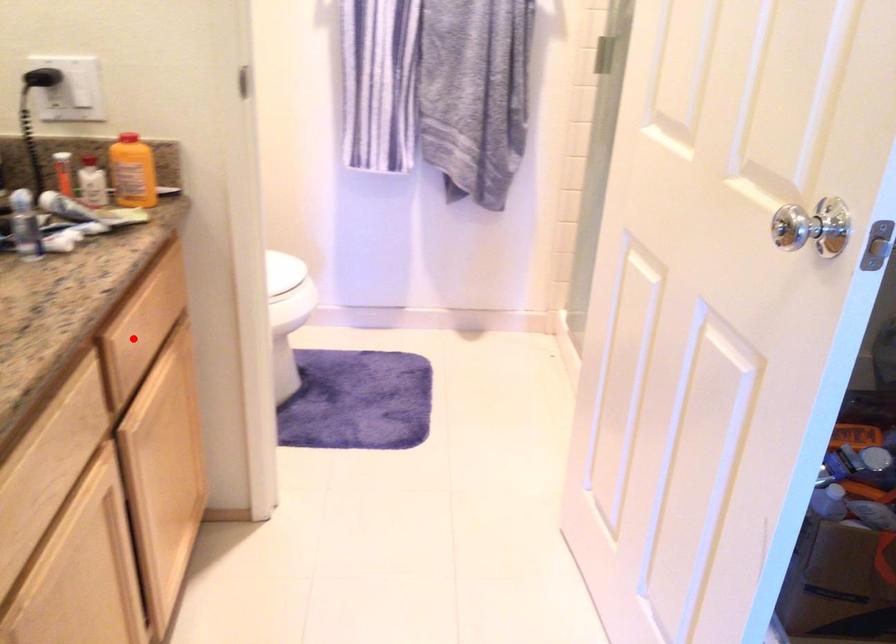
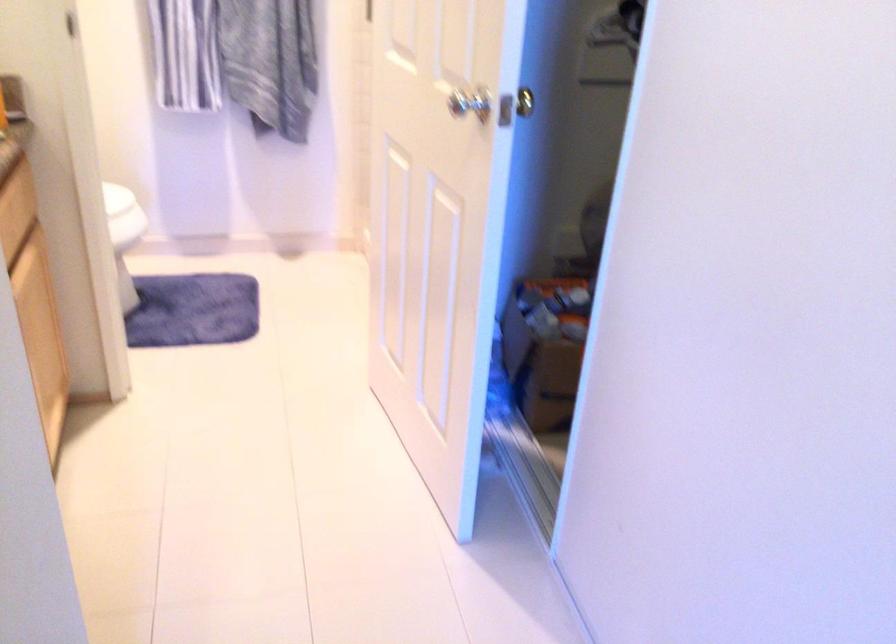
The point at the highlighted location is marked in the first image. Where is the corresponding point in the second image?

(12, 229)